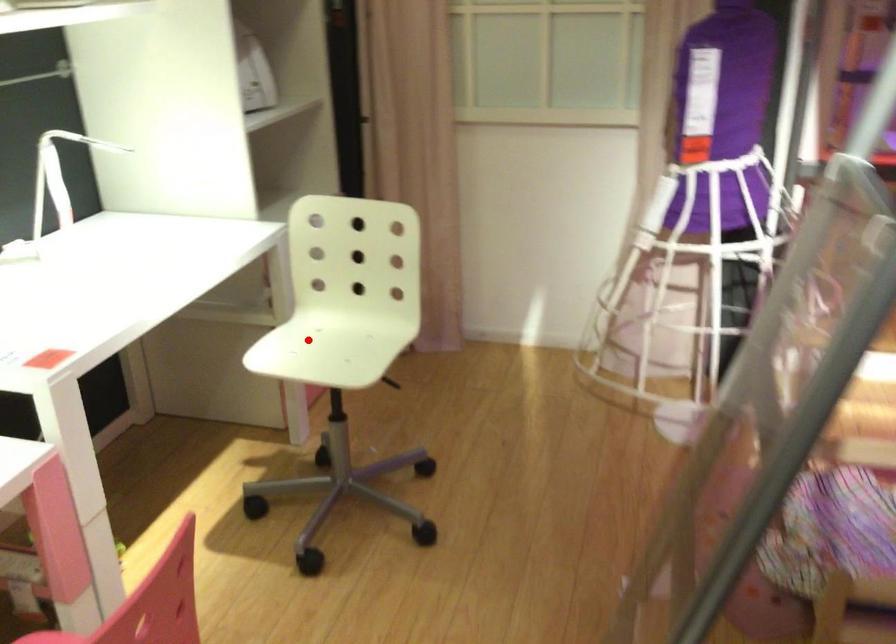
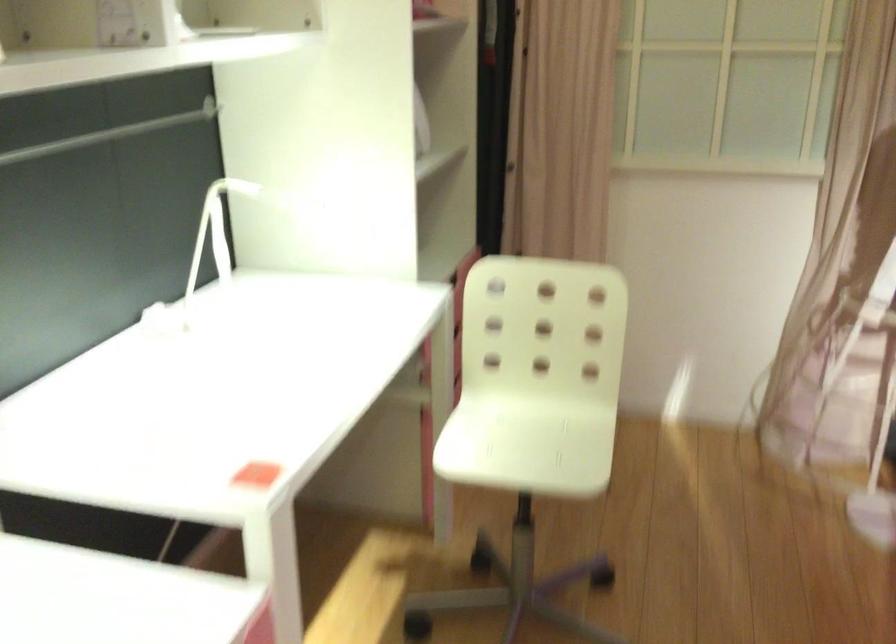
In the second image, find the point that corresponds to the highlighted location in the first image.

(495, 431)